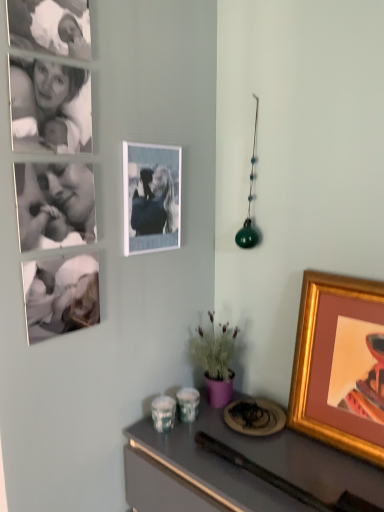
This screenshot has height=512, width=384. In order to click on blank space above metallic gray desk at lower right (from a real-world perspective) in this screenshot , I will do tap(252, 444).